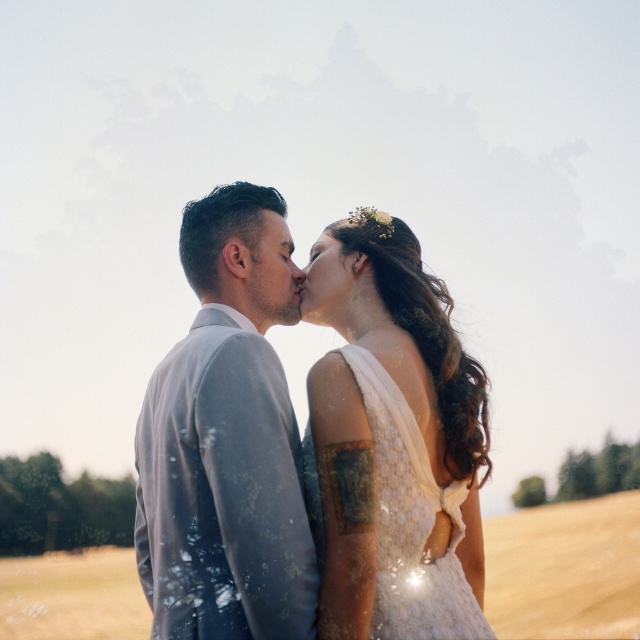
Is light gray suit at center taller than lace fabric dress at center?

Indeed, light gray suit at center has a greater height compared to lace fabric dress at center.

What do you see at coordinates (227, 440) in the screenshot?
I see `light gray suit at center` at bounding box center [227, 440].

Is point (156, 488) positioned behind point (403, 568)?

Yes, point (156, 488) is farther from viewer.

Locate an element on the screen. light gray suit at center is located at coordinates (227, 440).

Can you confirm if light gray suit at center is bigger than matte floral hair accessory at center?

Yes, light gray suit at center is bigger than matte floral hair accessory at center.

Can you confirm if light gray suit at center is smaller than matte floral hair accessory at center?

No.

The height and width of the screenshot is (640, 640). I want to click on light gray suit at center, so click(227, 440).

Is point (26, 572) closer to viewer compared to point (356, 474)?

No, it is behind (356, 474).

Is point (112, 589) positioned behind point (307, 426)?

Yes.

Where is `golden wheat field at lower right`? golden wheat field at lower right is located at coordinates (564, 570).